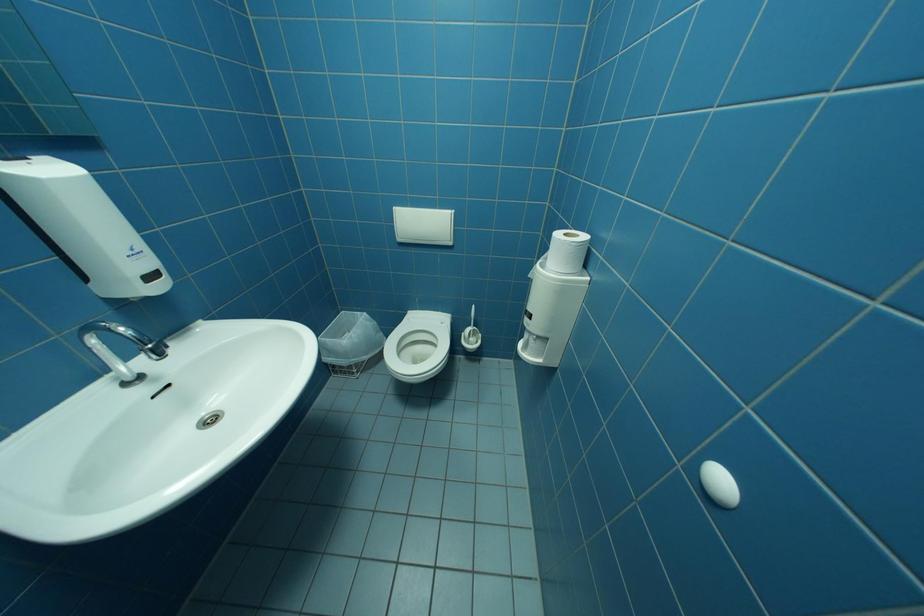
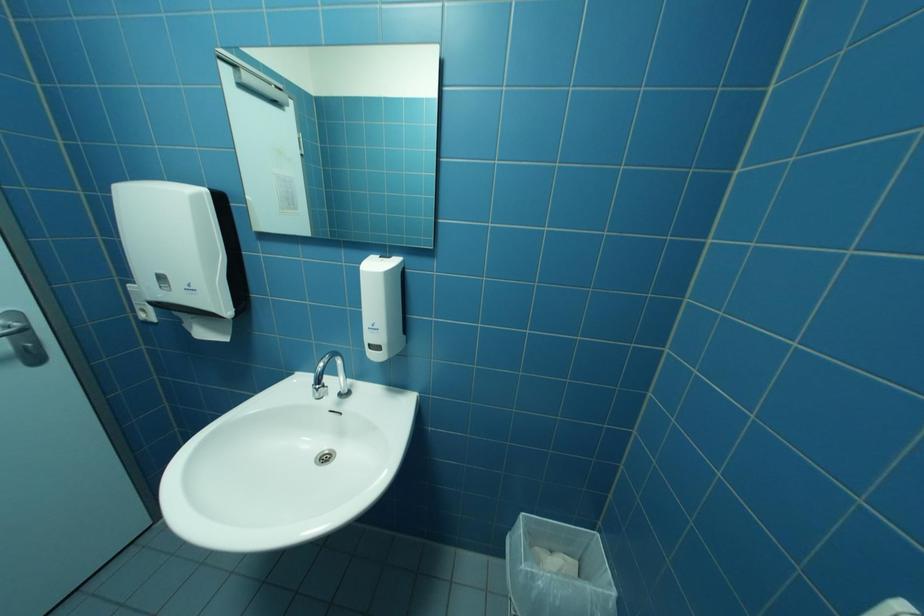
The images are taken continuously from a first-person perspective. In which direction is your viewpoint rotating?

The camera's rotation is toward left-down.